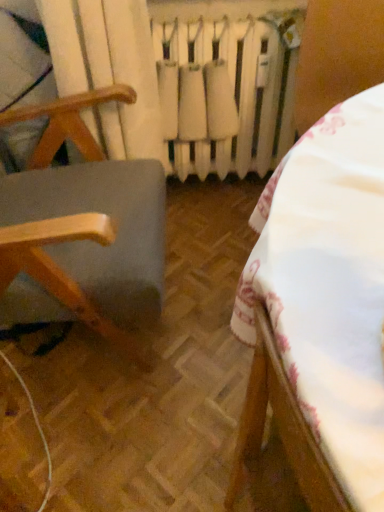
Question: Is white matte radiator at center in contact with white fabric tablecloth at center, the first furniture viewed from the right?

Choices:
 (A) yes
 (B) no

Answer: (B)

Question: Is white matte radiator at center shorter than white fabric tablecloth at center, the second furniture viewed from the left?

Choices:
 (A) no
 (B) yes

Answer: (B)

Question: Is the position of white matte radiator at center less distant than that of white fabric tablecloth at center, the second furniture viewed from the left?

Choices:
 (A) yes
 (B) no

Answer: (B)

Question: Does white matte radiator at center have a greater height compared to white fabric tablecloth at center, the first furniture viewed from the right?

Choices:
 (A) no
 (B) yes

Answer: (A)

Question: From a real-world perspective, does white matte radiator at center sit lower than white fabric tablecloth at center, the first furniture viewed from the right?

Choices:
 (A) yes
 (B) no

Answer: (A)

Question: Considering the relative sizes of white matte radiator at center and white fabric tablecloth at center, the second furniture viewed from the left, in the image provided, is white matte radiator at center thinner than white fabric tablecloth at center, the second furniture viewed from the left,?

Choices:
 (A) yes
 (B) no

Answer: (A)

Question: Can you confirm if wooden chair at left, acting as the 2th furniture starting from the right, is wider than white matte radiator at center?

Choices:
 (A) yes
 (B) no

Answer: (A)

Question: Does wooden chair at left, positioned as the first furniture in left-to-right order, have a smaller size compared to white matte radiator at center?

Choices:
 (A) yes
 (B) no

Answer: (B)

Question: From a real-world perspective, is wooden chair at left, acting as the 2th furniture starting from the right, located higher than white matte radiator at center?

Choices:
 (A) no
 (B) yes

Answer: (B)

Question: Is white matte radiator at center a part of wooden chair at left, positioned as the first furniture in left-to-right order?

Choices:
 (A) no
 (B) yes

Answer: (A)

Question: Can you confirm if wooden chair at left, positioned as the first furniture in left-to-right order, is positioned to the left of white matte radiator at center?

Choices:
 (A) yes
 (B) no

Answer: (A)

Question: Is wooden chair at left, positioned as the first furniture in left-to-right order, aimed at white matte radiator at center?

Choices:
 (A) no
 (B) yes

Answer: (A)

Question: Is wooden chair at left, positioned as the first furniture in left-to-right order, oriented away from white fabric tablecloth at center, the second furniture viewed from the left?

Choices:
 (A) yes
 (B) no

Answer: (B)